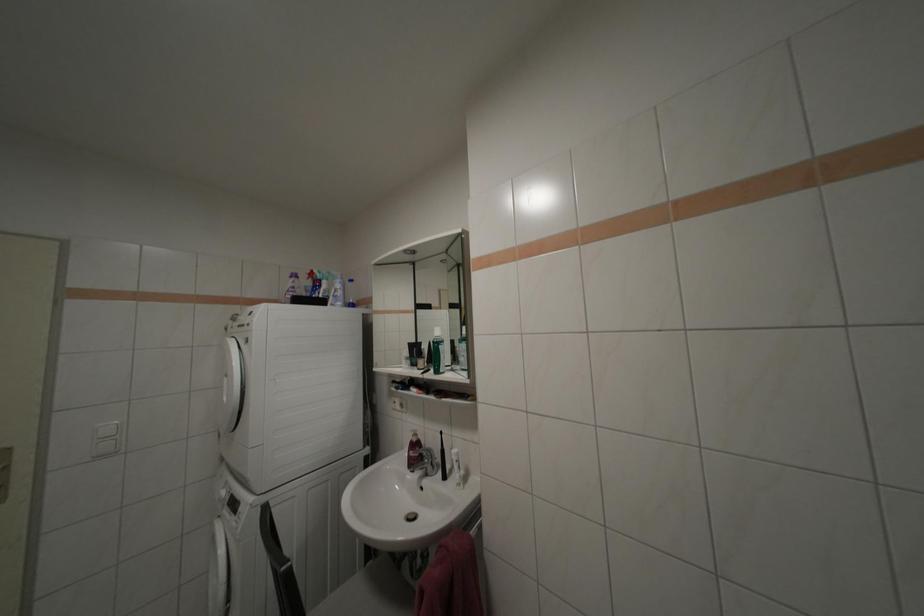
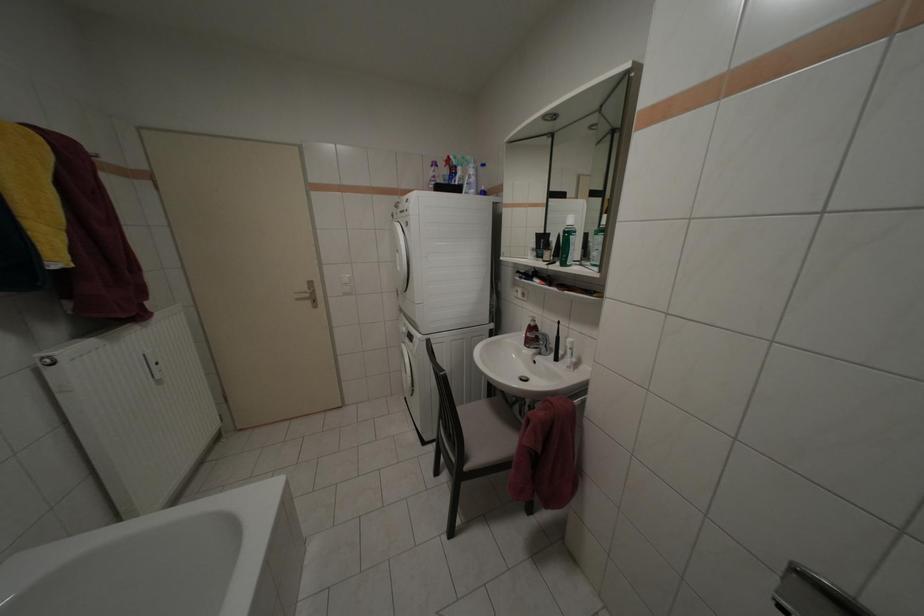
First-person continuous shooting, in which direction is the camera rotating?

The camera's rotation is toward left-down.